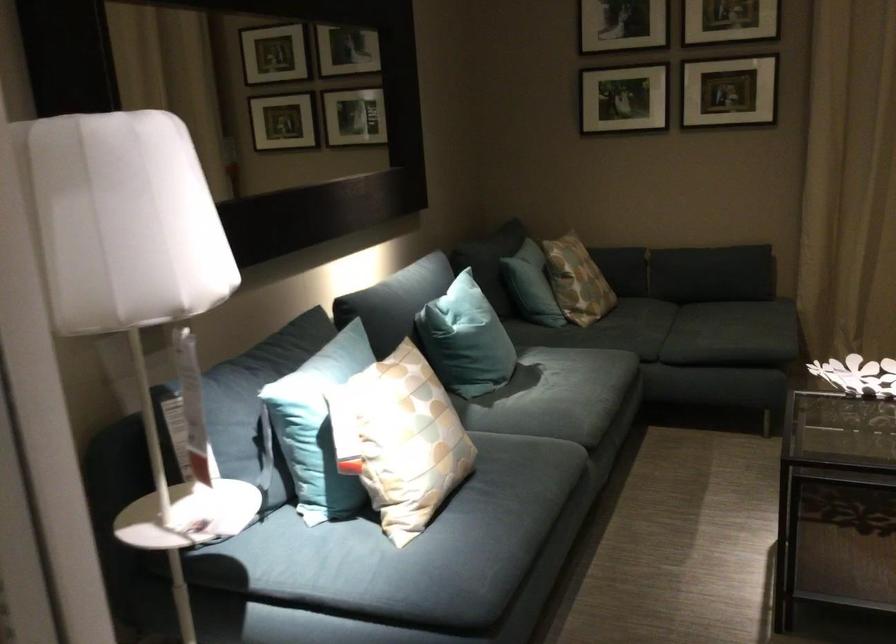
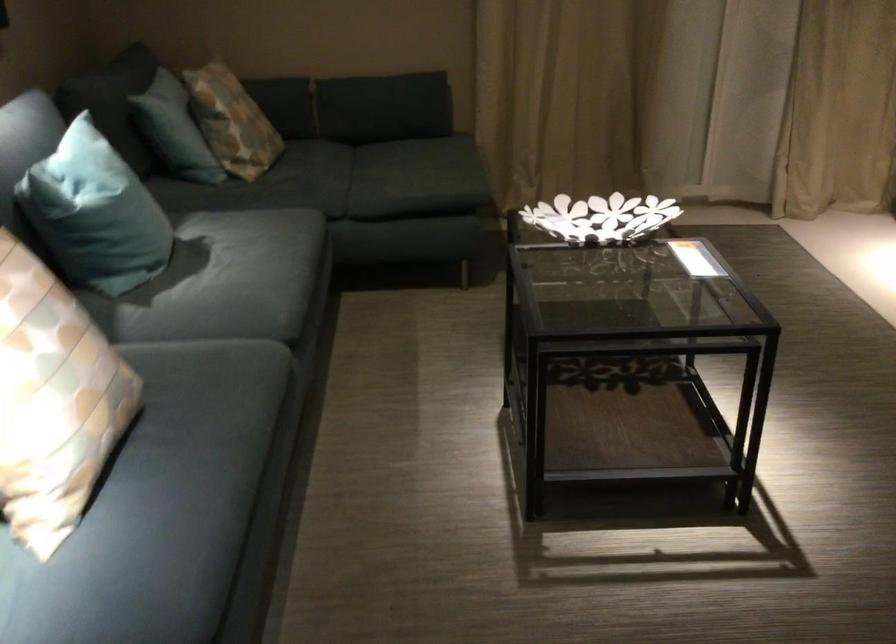
In the second image, find the point that corresponds to point (459, 334) in the first image.

(95, 214)